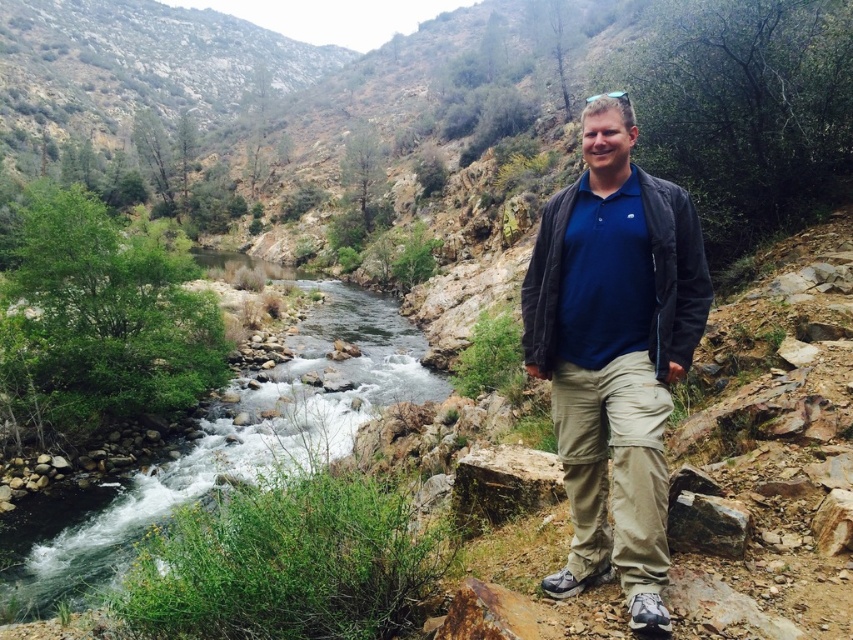
Is matte blue shirt at center positioned before green rocky stream at left?

Yes, matte blue shirt at center is closer to the viewer.

From the picture: Which of these two, matte blue shirt at center or green rocky stream at left, stands shorter?

Standing shorter between the two is matte blue shirt at center.

Is point (619, 285) more distant than point (291, 460)?

No, (619, 285) is closer to viewer.

Find the location of a particular element. This screenshot has width=853, height=640. matte blue shirt at center is located at coordinates (614, 352).